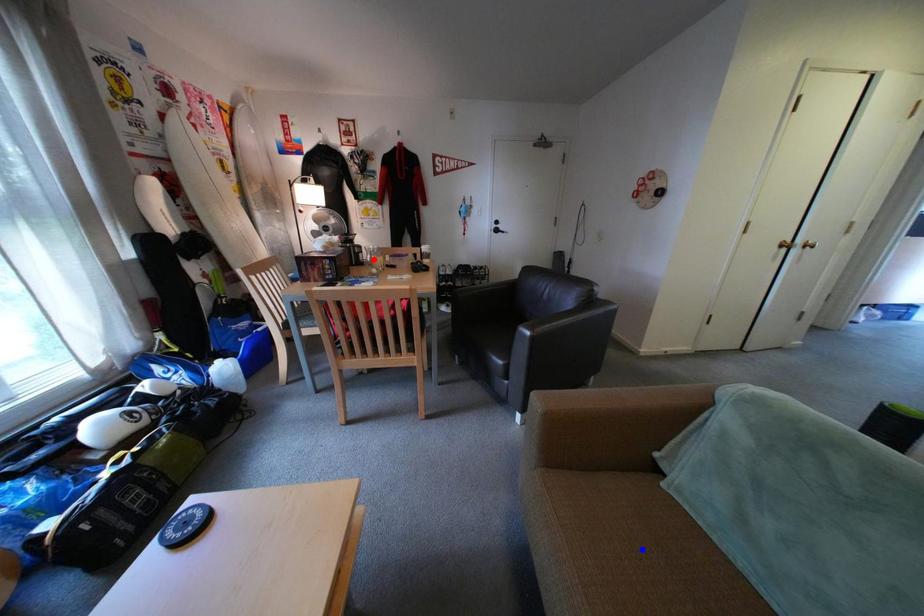
Question: In the image, two points are highlighted. Which point is nearer to the camera? Reply with the corresponding letter.

Choices:
 (A) blue point
 (B) red point

Answer: (A)